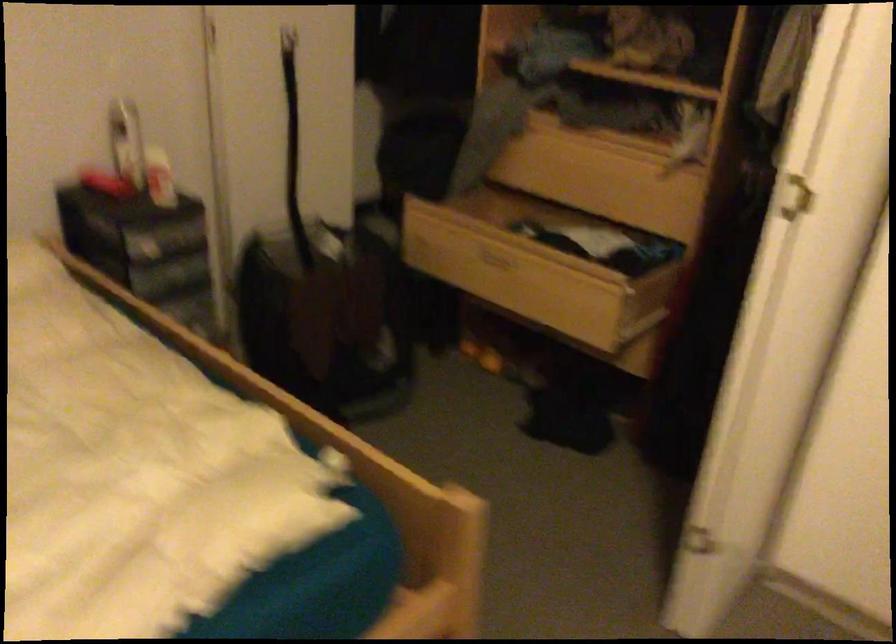
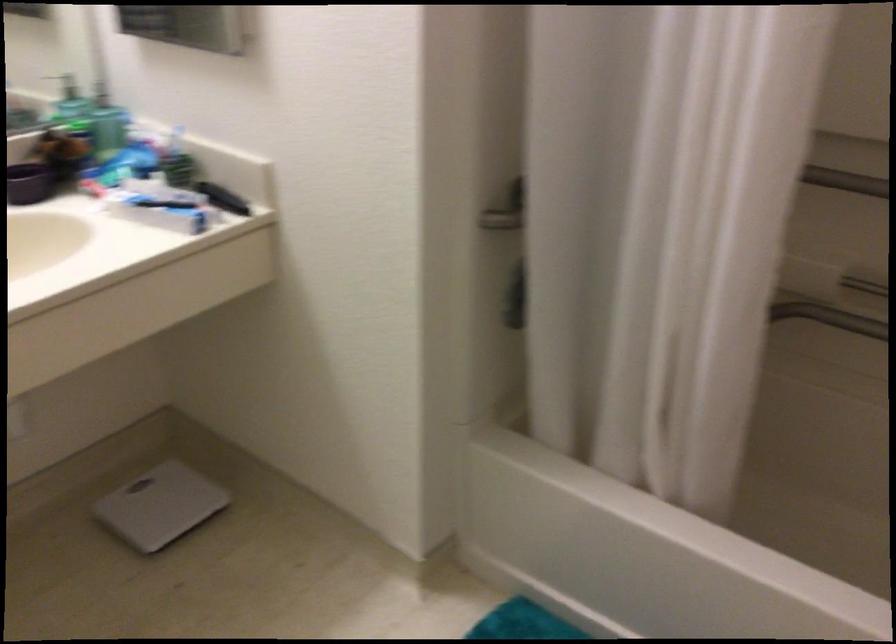
Which direction would the cameraman need to move to produce the second image?

The cameraman walked toward right, forward.